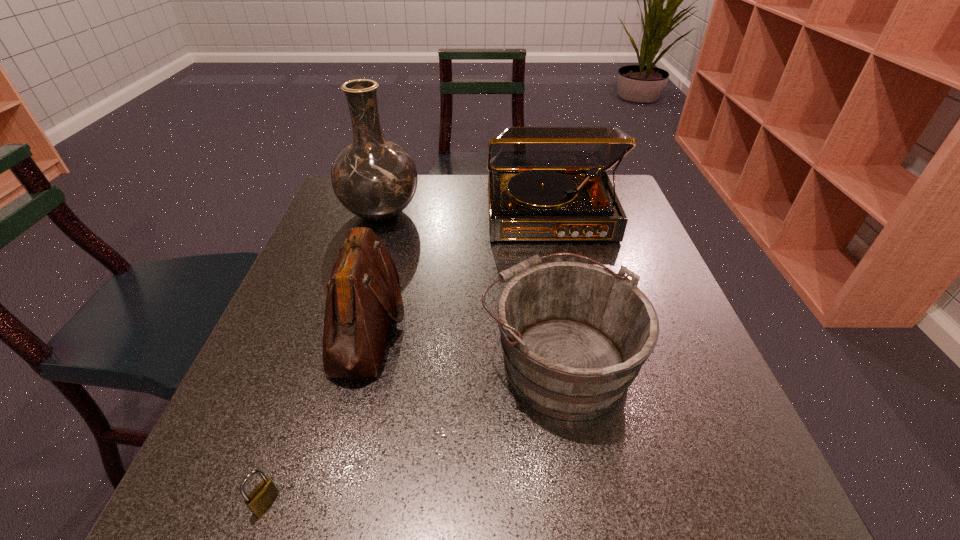
At what (x,y) coordinates should I click in order to perform the action: click on vacant area that lies between the shortest object and the fourth tallest object. Please return your answer as a coordinate pair (x, y). Looking at the image, I should click on (412, 431).

You are a GUI agent. You are given a task and a screenshot of the screen. Output one action in this format:
    pyautogui.click(x=<x>, y=<y>)
    Task: Click on the empty location between the fourth shortest object and the padlock
    This screenshot has width=960, height=540.
    Given the screenshot: What is the action you would take?
    pyautogui.click(x=408, y=359)

At what (x,y) coordinates should I click in order to perform the action: click on free spot between the tallest object and the record player. Please return your answer as a coordinate pair (x, y). The image size is (960, 540). Looking at the image, I should click on (466, 214).

You are a GUI agent. You are given a task and a screenshot of the screen. Output one action in this format:
    pyautogui.click(x=<x>, y=<y>)
    Task: Click on the object that is the fourth closest one to the tallest object
    This screenshot has height=540, width=960.
    Given the screenshot: What is the action you would take?
    pyautogui.click(x=264, y=494)

Identify which object is the second closest to the second tallest object. Please provide its 2D coordinates. Your answer should be formatted as a tuple, i.e. [(x, y)], where the tuple contains the x and y coordinates of a point satisfying the conditions above.

[(574, 336)]

Locate an element on the screen. The width and height of the screenshot is (960, 540). free point that satisfies the following two spatial constraints: 1. on the front side of the tallest object; 2. on the left side of the shoulder bag is located at coordinates (347, 325).